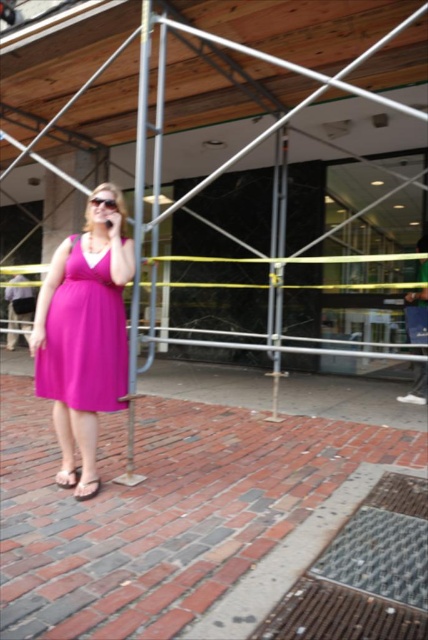
Question: Does metallic scaffolding at center appear on the right side of pink fabric sandal at lower left?

Choices:
 (A) no
 (B) yes

Answer: (B)

Question: Which object appears farthest from the camera in this image?

Choices:
 (A) green fabric bag at right
 (B) purple satin dress at center
 (C) pink fabric sandal at lower left

Answer: (A)

Question: Is pink fabric sandal at lower left smaller than matte pink sandal at lower left?

Choices:
 (A) no
 (B) yes

Answer: (A)

Question: Among these points, which one is nearest to the camera?

Choices:
 (A) (73, 483)
 (B) (68, 346)
 (C) (270, 356)
 (D) (413, 396)

Answer: (B)

Question: Which point is closer to the camera?

Choices:
 (A) green fabric bag at right
 (B) matte pink sandal at lower left

Answer: (B)

Question: Is purple satin dress at center positioned behind green fabric bag at right?

Choices:
 (A) no
 (B) yes

Answer: (A)